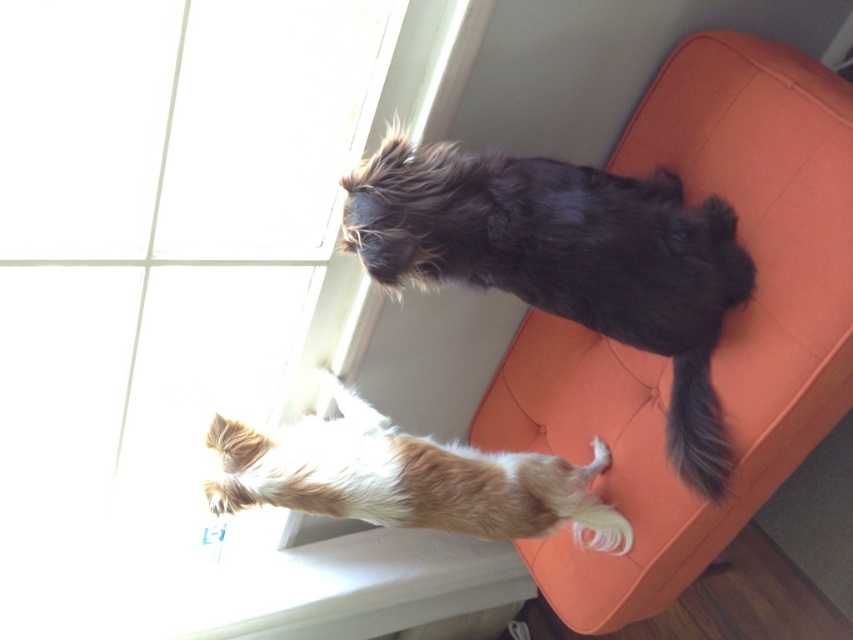
You are a photographer trying to capture the shaggy black dog at upper right and the blue silky tail at lower right in a single frame. Which object should you focus on first if you want to ensure both are in focus without moving the camera?

You should focus on the shaggy black dog at upper right first because it is wider than the blue silky tail at lower right, so focusing on the wider object will help keep both in focus.

You are a photographer trying to capture the dog in the window. You notice the blue silky tail at lower right and the brown fur dog at upper right. Which object is closer to the camera, and why?

The brown fur dog at upper right is closer to the camera because the blue silky tail at lower right is behind it.

You are a photographer trying to capture the dog in the image. The dog is currently at point (404, 477). You want to position your camera so that the dog is centered in the frame. Which direction should you move the camera to achieve this?

The point (404, 477) corresponds to the brown fur dog at upper right. To center the dog in the frame, you should move the camera to the left and down.